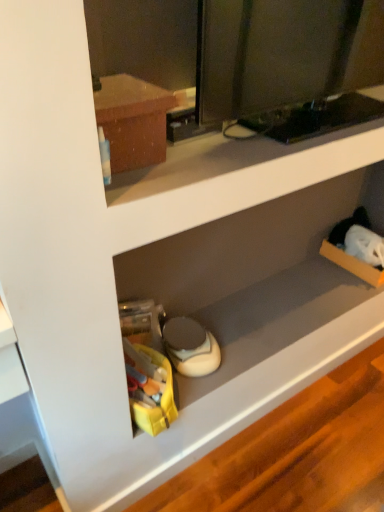
Locate an element on the screen. The width and height of the screenshot is (384, 512). free space above matte brown cabinet at upper left (from a real-world perspective) is located at coordinates (123, 87).